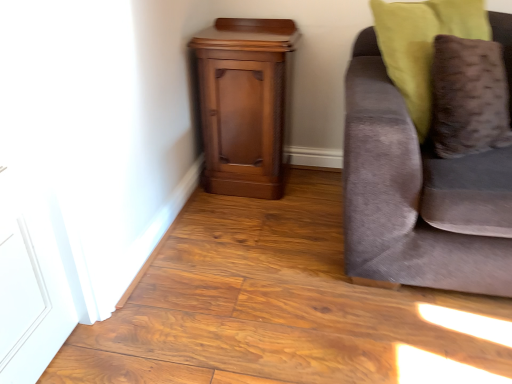
This screenshot has width=512, height=384. What do you see at coordinates (418, 195) in the screenshot? I see `velvet gray couch at right` at bounding box center [418, 195].

What is the approximate width of polished wood nightstand at lower left?

The width of polished wood nightstand at lower left is 16.48 inches.

You are a GUI agent. You are given a task and a screenshot of the screen. Output one action in this format:
    pyautogui.click(x=<x>, y=<y>)
    Task: Click on the velvet brown pillow at right
    
    Given the screenshot: What is the action you would take?
    pyautogui.click(x=422, y=45)

From the image's perspective, which one is positioned higher, velvet brown pillow at right or polished wood nightstand at lower left?

From the image's view, polished wood nightstand at lower left is above.

Measure the distance from velvet brown pillow at right to polished wood nightstand at lower left.

velvet brown pillow at right is 23.85 inches away from polished wood nightstand at lower left.

Does velvet brown pillow at right turn towards polished wood nightstand at lower left?

No, velvet brown pillow at right is not aimed at polished wood nightstand at lower left.

Is velvet brown pillow at right touching polished wood nightstand at lower left?

There is a gap between velvet brown pillow at right and polished wood nightstand at lower left.

Is polished wood nightstand at lower left shorter than velvet gray couch at right?

Yes.

Is there a large distance between polished wood nightstand at lower left and velvet gray couch at right?

No, there isn't a large distance between polished wood nightstand at lower left and velvet gray couch at right.

In order to click on nightstand on the left of the velvet gray couch at right in this screenshot , I will do `click(243, 103)`.

From the image's perspective, which one is positioned higher, polished wood nightstand at lower left or velvet gray couch at right?

polished wood nightstand at lower left, from the image's perspective.

Does point (392, 75) come farther from viewer compared to point (376, 221)?

Yes, it is.

Based on the photo, can you tell me how much velvet brown pillow at right and velvet gray couch at right differ in facing direction?

The angle between the facing direction of velvet brown pillow at right and the facing direction of velvet gray couch at right is 40 degrees.

Can velvet gray couch at right be found inside velvet brown pillow at right?

No, velvet gray couch at right is located outside of velvet brown pillow at right.

Considering the sizes of velvet brown pillow at right and velvet gray couch at right in the image, is velvet brown pillow at right wider or thinner than velvet gray couch at right?

Considering their sizes, velvet brown pillow at right looks slimmer than velvet gray couch at right.

I want to click on studio couch that is below the velvet brown pillow at right (from the image's perspective), so click(418, 195).

Is velvet gray couch at right bigger than velvet brown pillow at right?

Yes, velvet gray couch at right is bigger than velvet brown pillow at right.

Is velvet gray couch at right aimed at velvet brown pillow at right?

Yes.

Would you say velvet brown pillow at right is part of velvet gray couch at right's contents?

Yes, velvet gray couch at right is surrounding velvet brown pillow at right.

From the image's perspective, which is below, polished wood nightstand at lower left or velvet brown pillow at right?

From the image's view, velvet brown pillow at right is below.

From a real-world perspective, is polished wood nightstand at lower left positioned under velvet brown pillow at right based on gravity?

Yes, from a real-world perspective, polished wood nightstand at lower left is below velvet brown pillow at right.

Is polished wood nightstand at lower left not near velvet brown pillow at right?

No.

Identify the location of nightstand behind the velvet brown pillow at right. (243, 103).

Considering their positions, is velvet gray couch at right located in front of or behind polished wood nightstand at lower left?

In the image, velvet gray couch at right appears in front of polished wood nightstand at lower left.

From the image's perspective, which one is positioned higher, velvet gray couch at right or polished wood nightstand at lower left?

polished wood nightstand at lower left appears higher in the image.

Can you confirm if velvet gray couch at right is wider than polished wood nightstand at lower left?

Indeed, velvet gray couch at right has a greater width compared to polished wood nightstand at lower left.

Is velvet gray couch at right next to polished wood nightstand at lower left?

No, velvet gray couch at right is not making contact with polished wood nightstand at lower left.

The image size is (512, 384). In order to click on pillow below the polished wood nightstand at lower left (from the image's perspective) in this screenshot , I will do `click(422, 45)`.

The width and height of the screenshot is (512, 384). Find the location of `studio couch that appears on the right of polished wood nightstand at lower left`. studio couch that appears on the right of polished wood nightstand at lower left is located at coordinates (418, 195).

Based on the photo, estimate the real-world distances between objects in this image. Which object is further from velvet brown pillow at right, velvet gray couch at right or polished wood nightstand at lower left?

polished wood nightstand at lower left.

Estimate the real-world distances between objects in this image. Which object is closer to velvet gray couch at right, velvet brown pillow at right or polished wood nightstand at lower left?

Among the two, velvet brown pillow at right is located nearer to velvet gray couch at right.

From the picture: Based on their spatial positions, is velvet brown pillow at right or velvet gray couch at right closer to polished wood nightstand at lower left?

Among the two, velvet brown pillow at right is located nearer to polished wood nightstand at lower left.

When comparing their distances from polished wood nightstand at lower left, does velvet gray couch at right or velvet brown pillow at right seem further?

velvet gray couch at right.

Based on the photo, looking at the image, which one is located further to velvet brown pillow at right, polished wood nightstand at lower left or velvet gray couch at right?

polished wood nightstand at lower left is positioned further to the anchor velvet brown pillow at right.

When comparing their distances from velvet gray couch at right, does polished wood nightstand at lower left or velvet brown pillow at right seem further?

Among the two, polished wood nightstand at lower left is located further to velvet gray couch at right.

Identify the location of pillow situated between polished wood nightstand at lower left and velvet gray couch at right from left to right. pyautogui.click(x=422, y=45).